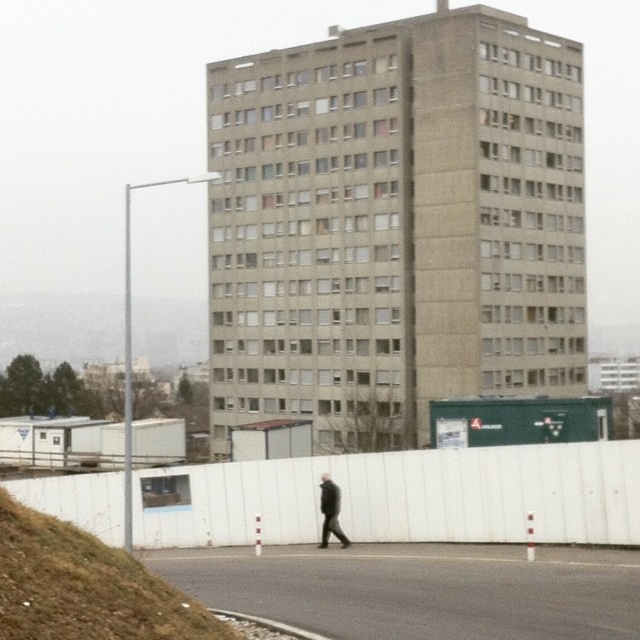
Question: Can you confirm if green grass at lower left is wider than dark gray coat at center?

Choices:
 (A) no
 (B) yes

Answer: (B)

Question: Which point is closer to the camera?

Choices:
 (A) green grass at lower left
 (B) dark gray coat at center

Answer: (A)

Question: Which point is closer to the camera?

Choices:
 (A) dark gray coat at center
 (B) green grass at lower left

Answer: (B)

Question: Is gray concrete building at center to the left of green grass at lower left from the viewer's perspective?

Choices:
 (A) yes
 (B) no

Answer: (A)

Question: Does gray concrete building at center have a greater width compared to green grass at lower left?

Choices:
 (A) yes
 (B) no

Answer: (A)

Question: Which of these objects is positioned farthest from the gray concrete building at center?

Choices:
 (A) dark gray coat at center
 (B) green grass at lower left

Answer: (B)